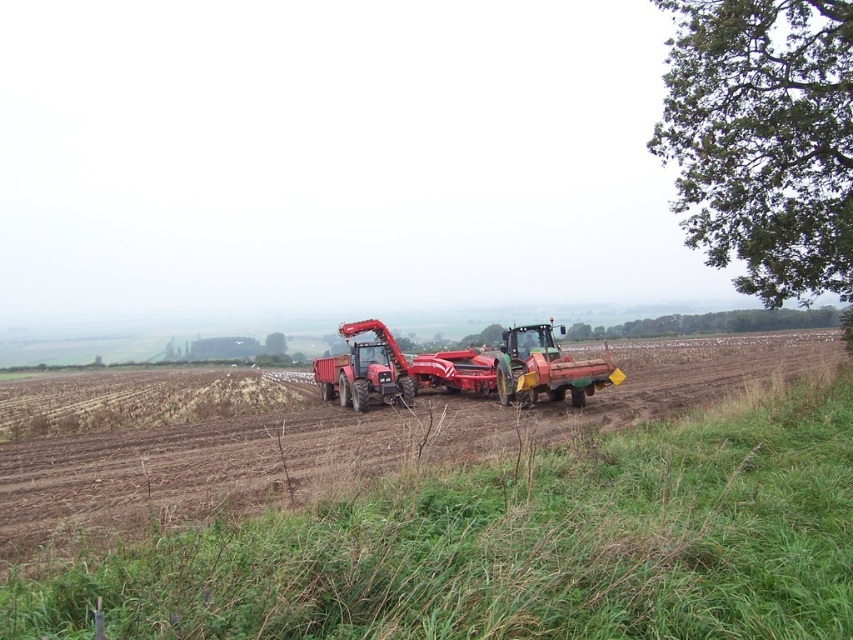
Which of these two, green grass at lower right or green matte tractor at center, stands taller?

With more height is green matte tractor at center.

Which is behind, point (839, 460) or point (502, 404)?

The point (502, 404) is more distant.

Find the location of `green grass at lower right`. green grass at lower right is located at coordinates (515, 545).

Which of these two, green matte tractor at center or matte red tractor at center, stands shorter?

Standing shorter between the two is green matte tractor at center.

Who is positioned more to the left, green matte tractor at center or matte red tractor at center?

Positioned to the left is matte red tractor at center.

Image resolution: width=853 pixels, height=640 pixels. I want to click on green matte tractor at center, so click(x=546, y=369).

Consider the image. Is the position of green grass at lower right more distant than that of matte red tractor at center?

No, green grass at lower right is in front of matte red tractor at center.

Is green grass at lower right wider than matte red tractor at center?

Indeed, green grass at lower right has a greater width compared to matte red tractor at center.

Is point (610, 573) less distant than point (393, 385)?

Yes, point (610, 573) is in front of point (393, 385).

Identify the location of green grass at lower right. (515, 545).